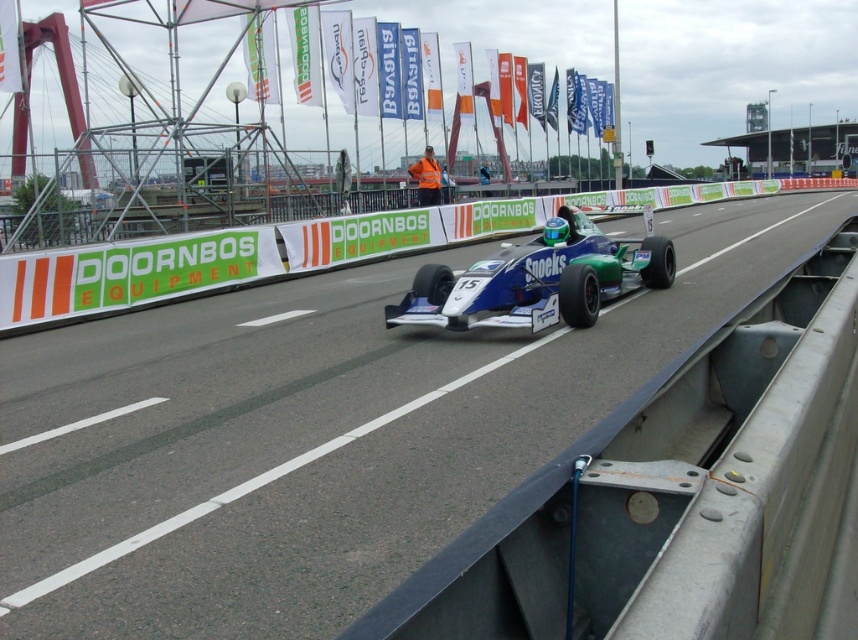
What is the relationship between the height of the smooth asphalt road at center and the blue glossy race car at center?

The smooth asphalt road at center is taller than the blue glossy race car at center.

You are a drone operator trying to capture aerial footage of the race track. You notice two points marked on your map at coordinates point (x=609, y=225) and point (x=466, y=291). Which point is closer to your drone camera when flying directly above the race track?

Point (x=609, y=225) is further to the viewer than point (x=466, y=291), so the point closer to the drone camera would be point (x=466, y=291) since it is nearer to the viewer.